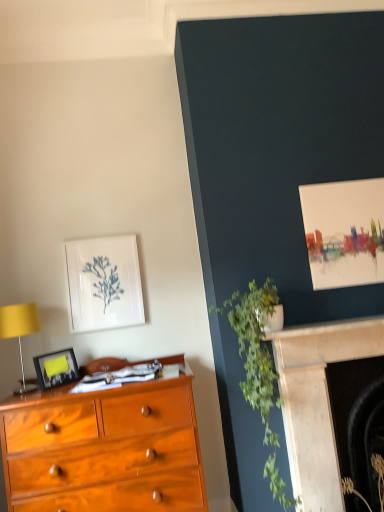
Question: Considering the relative sizes of matte yellow lampshade at left and white matte picture frame at upper left, which is the 2th picture frame in bottom-to-top order, in the image provided, is matte yellow lampshade at left shorter than white matte picture frame at upper left, which is the 2th picture frame in bottom-to-top order,?

Choices:
 (A) no
 (B) yes

Answer: (B)

Question: Can you confirm if matte yellow lampshade at left is taller than white matte picture frame at upper left, positioned as the first picture frame in top-to-bottom order?

Choices:
 (A) no
 (B) yes

Answer: (A)

Question: Is matte yellow lampshade at left bigger than white matte picture frame at upper left, the second picture frame when ordered from front to back?

Choices:
 (A) no
 (B) yes

Answer: (B)

Question: Does matte yellow lampshade at left turn towards white matte picture frame at upper left, positioned as the first picture frame in top-to-bottom order?

Choices:
 (A) yes
 (B) no

Answer: (B)

Question: Considering the relative sizes of matte yellow lampshade at left and white matte picture frame at upper left, the second picture frame when ordered from front to back, in the image provided, is matte yellow lampshade at left thinner than white matte picture frame at upper left, the second picture frame when ordered from front to back,?

Choices:
 (A) yes
 (B) no

Answer: (B)

Question: From a real-world perspective, is matte yellow lampshade at left positioned over white matte picture frame at upper left, the second picture frame when ordered from front to back, based on gravity?

Choices:
 (A) no
 (B) yes

Answer: (A)

Question: Considering the relative sizes of white matte picture frame at upper left, the second picture frame when ordered from front to back, and marble fireplace at lower right, which is the 2th fireplace from front to back, in the image provided, is white matte picture frame at upper left, the second picture frame when ordered from front to back, wider than marble fireplace at lower right, which is the 2th fireplace from front to back,?

Choices:
 (A) no
 (B) yes

Answer: (A)

Question: Can you confirm if white matte picture frame at upper left, which is the 2th picture frame in bottom-to-top order, is bigger than marble fireplace at lower right, the first fireplace in the back-to-front sequence?

Choices:
 (A) no
 (B) yes

Answer: (A)

Question: From the image's perspective, is white matte picture frame at upper left, the second picture frame when ordered from front to back, under marble fireplace at lower right, the first fireplace in the back-to-front sequence?

Choices:
 (A) no
 (B) yes

Answer: (A)

Question: Is white matte picture frame at upper left, the first picture frame positioned from the back, far away from marble fireplace at lower right, the first fireplace in the back-to-front sequence?

Choices:
 (A) yes
 (B) no

Answer: (A)

Question: Is marble fireplace at lower right, which is the 2th fireplace from front to back, completely or partially inside white matte picture frame at upper left, which is the 2th picture frame in bottom-to-top order?

Choices:
 (A) no
 (B) yes

Answer: (A)

Question: Considering the relative sizes of white matte picture frame at upper left, positioned as the first picture frame in top-to-bottom order, and marble fireplace at lower right, the first fireplace in the back-to-front sequence, in the image provided, is white matte picture frame at upper left, positioned as the first picture frame in top-to-bottom order, smaller than marble fireplace at lower right, the first fireplace in the back-to-front sequence,?

Choices:
 (A) no
 (B) yes

Answer: (B)

Question: Does marble fireplace at lower right, which is the 2th fireplace from front to back, have a lesser width compared to green leafy plant at upper right, which is counted as the 2th plant, starting from the right?

Choices:
 (A) yes
 (B) no

Answer: (A)